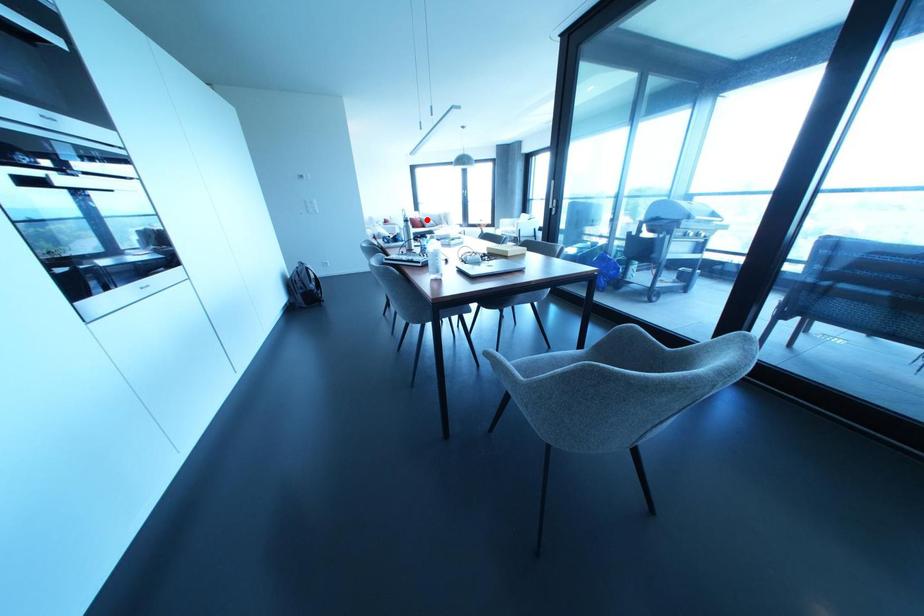
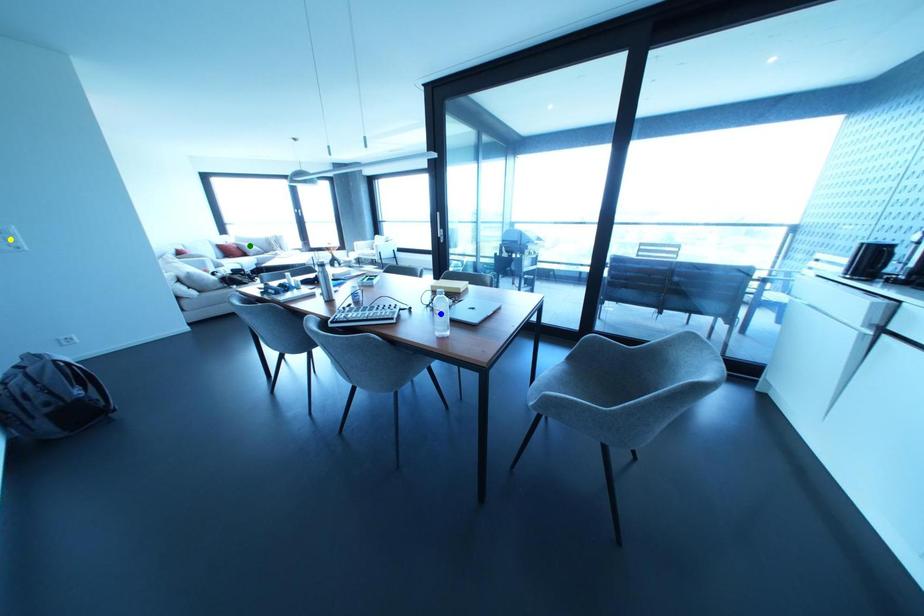
Question: I am providing you with two images of the same scene from different viewpoints. A red point is marked on the first image. You are given multiple points on the second image. In image 2, which mark is for the same physical point as the one in image 1?

Choices:
 (A) blue point
 (B) yellow point
 (C) green point

Answer: (C)